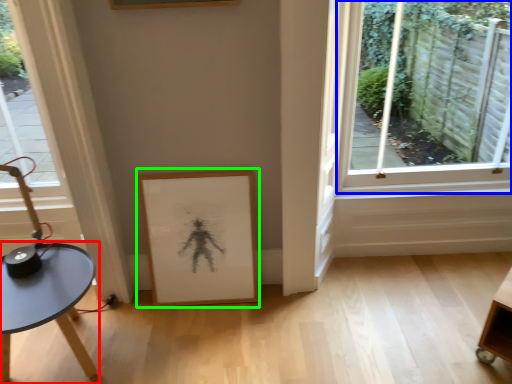
Question: Which object is positioned farthest from table (highlighted by a red box)? Select from window (highlighted by a blue box) and picture frame (highlighted by a green box).

Choices:
 (A) window
 (B) picture frame

Answer: (A)